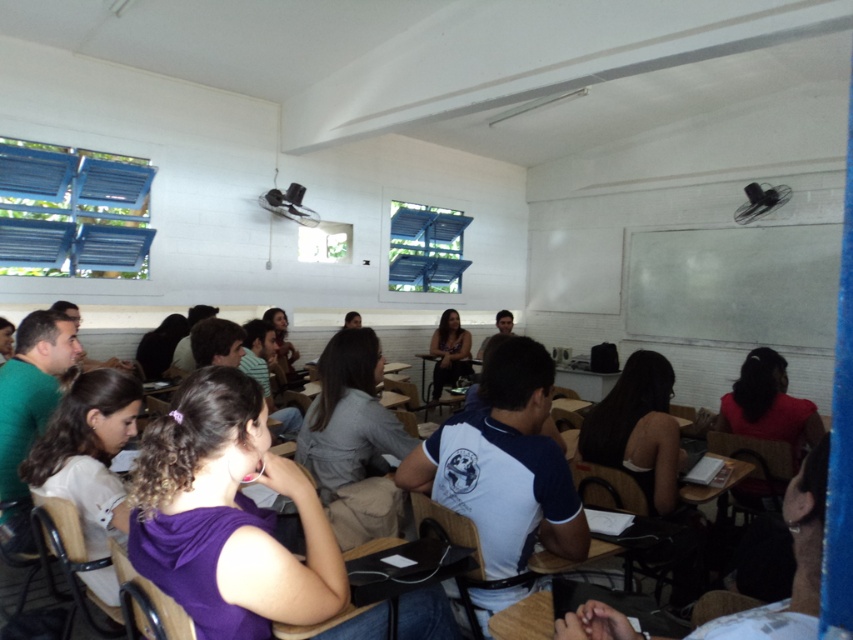
Question: Observing the image, what is the correct spatial positioning of white matte chalkboard at upper right in reference to matte black dress at center?

Choices:
 (A) left
 (B) right

Answer: (B)

Question: In this image, where is white matte chalkboard at upper right located relative to matte black dress at center?

Choices:
 (A) above
 (B) below

Answer: (A)

Question: Is white matte chalkboard at upper right thinner than matte black dress at center?

Choices:
 (A) no
 (B) yes

Answer: (A)

Question: Among these objects, which one is farthest from the camera?

Choices:
 (A) matte black dress at center
 (B) white matte chalkboard at upper right

Answer: (A)

Question: Among these objects, which one is nearest to the camera?

Choices:
 (A) matte black dress at center
 (B) white matte chalkboard at upper right

Answer: (B)